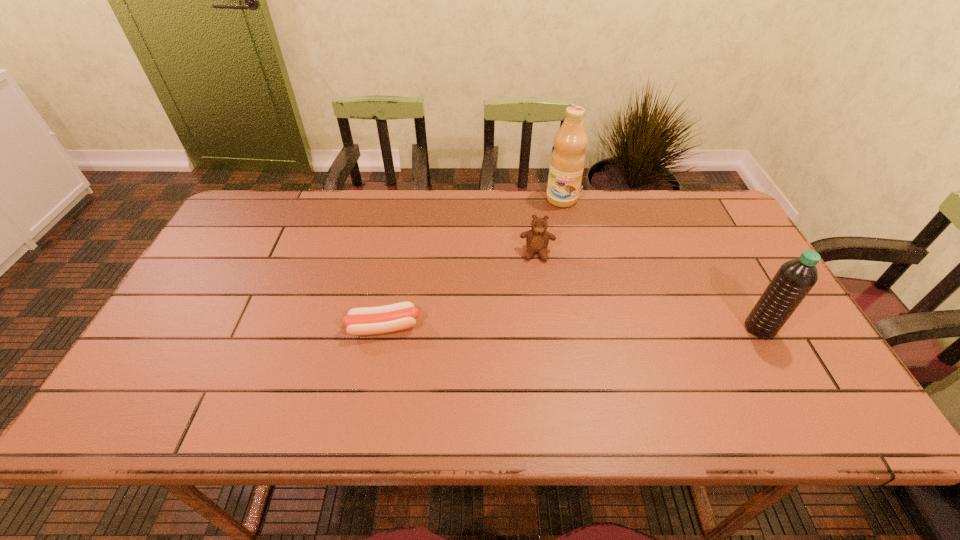
Find the location of a particular element. sausage is located at coordinates (382, 319).

At what (x,y) coordinates should I click in order to perform the action: click on the shortest object. Please return your answer as a coordinate pair (x, y). The height and width of the screenshot is (540, 960). Looking at the image, I should click on (382, 319).

The height and width of the screenshot is (540, 960). In order to click on water bottle in this screenshot , I will do `click(794, 279)`.

Where is `the rightmost object`? The height and width of the screenshot is (540, 960). the rightmost object is located at coordinates (794, 279).

Identify the location of the third object from right to left. This screenshot has width=960, height=540. (537, 239).

At what (x,y) coordinates should I click in order to perform the action: click on the second farthest object. Please return your answer as a coordinate pair (x, y). Looking at the image, I should click on (537, 239).

Where is `the second object from right to left`? The width and height of the screenshot is (960, 540). the second object from right to left is located at coordinates (567, 161).

What are the coordinates of `the farthest object` in the screenshot? It's located at (567, 161).

Find the location of a particular element. The image size is (960, 540). free spot located 0.090m on the back of the shortest object is located at coordinates (391, 287).

Where is `free space located 0.380m on the left of the second tallest object`? The height and width of the screenshot is (540, 960). free space located 0.380m on the left of the second tallest object is located at coordinates (592, 328).